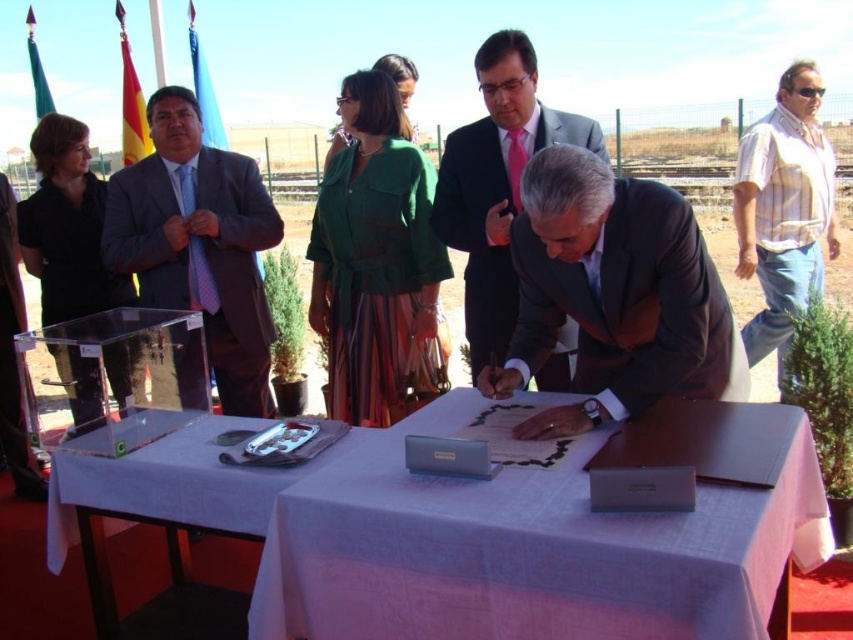
Which is more to the right, white cloth at center or matte purple tie at left?

From the viewer's perspective, white cloth at center appears more on the right side.

Is white cloth at center to the left of matte purple tie at left from the viewer's perspective?

In fact, white cloth at center is to the right of matte purple tie at left.

This screenshot has width=853, height=640. What do you see at coordinates (531, 545) in the screenshot?
I see `white cloth at center` at bounding box center [531, 545].

Where is `white cloth at center`? Image resolution: width=853 pixels, height=640 pixels. white cloth at center is located at coordinates (531, 545).

Is light gray suit at center further to camera compared to white cloth-covered table at center?

Yes, light gray suit at center is behind white cloth-covered table at center.

Can you confirm if light gray suit at center is shorter than white cloth-covered table at center?

No, light gray suit at center is not shorter than white cloth-covered table at center.

You are a GUI agent. You are given a task and a screenshot of the screen. Output one action in this format:
    pyautogui.click(x=<x>, y=<y>)
    Task: Click on the light gray suit at center
    The width and height of the screenshot is (853, 640).
    Given the screenshot: What is the action you would take?
    pyautogui.click(x=497, y=184)

This screenshot has width=853, height=640. What do you see at coordinates (531, 545) in the screenshot? I see `white cloth at center` at bounding box center [531, 545].

Between white cloth at center and light gray suit at center, which one has more height?

Standing taller between the two is light gray suit at center.

Does point (592, 518) come closer to viewer compared to point (599, 138)?

Yes, point (592, 518) is closer to viewer.

Identify the location of white cloth at center. (531, 545).